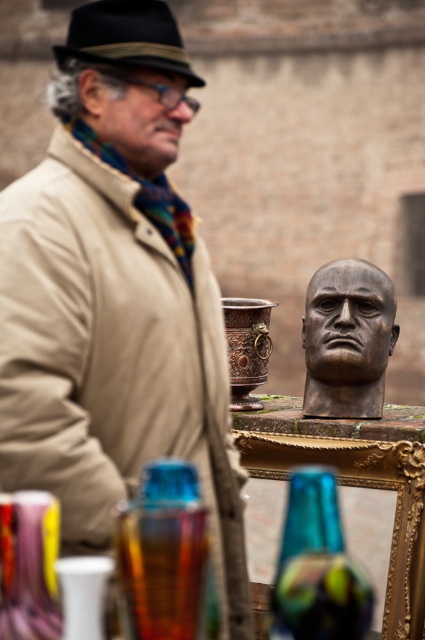
Can you confirm if beige wool coat at left is positioned to the left of copper metallic pot at center?

Indeed, beige wool coat at left is positioned on the left side of copper metallic pot at center.

Can you confirm if beige wool coat at left is smaller than copper metallic pot at center?

No, beige wool coat at left is not smaller than copper metallic pot at center.

Is point (79, 216) positioned after point (261, 406)?

No, it is in front of (261, 406).

Locate an element on the screen. The image size is (425, 640). beige wool coat at left is located at coordinates (116, 298).

Between translucent amber glass vase at lower left and matte brown wooden head at center, which one has more height?

matte brown wooden head at center is taller.

Is translucent amber glass vase at lower left taller than matte brown wooden head at center?

In fact, translucent amber glass vase at lower left may be shorter than matte brown wooden head at center.

Is point (215, 600) closer to viewer compared to point (139, 96)?

Yes, it is in front of point (139, 96).

In order to click on translucent amber glass vase at lower left in this screenshot , I will do `click(166, 556)`.

Can you confirm if translucent iridescent vase at center is positioned below copper metallic pot at center?

Correct, translucent iridescent vase at center is located below copper metallic pot at center.

Find the location of a particular element. The image size is (425, 640). translucent iridescent vase at center is located at coordinates (317, 566).

Find the location of a particular element. The height and width of the screenshot is (640, 425). translucent iridescent vase at center is located at coordinates (317, 566).